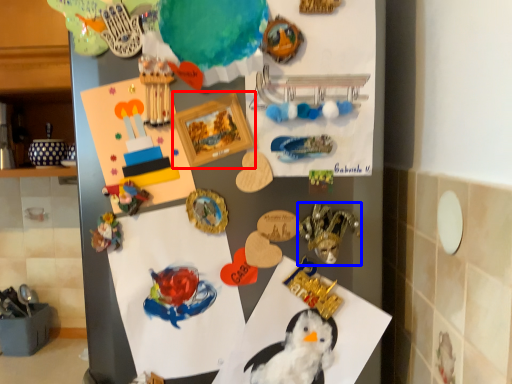
Question: Which point is further to the camera, picture frame (highlighted by a red box) or toy (highlighted by a blue box)?

Choices:
 (A) picture frame
 (B) toy

Answer: (B)